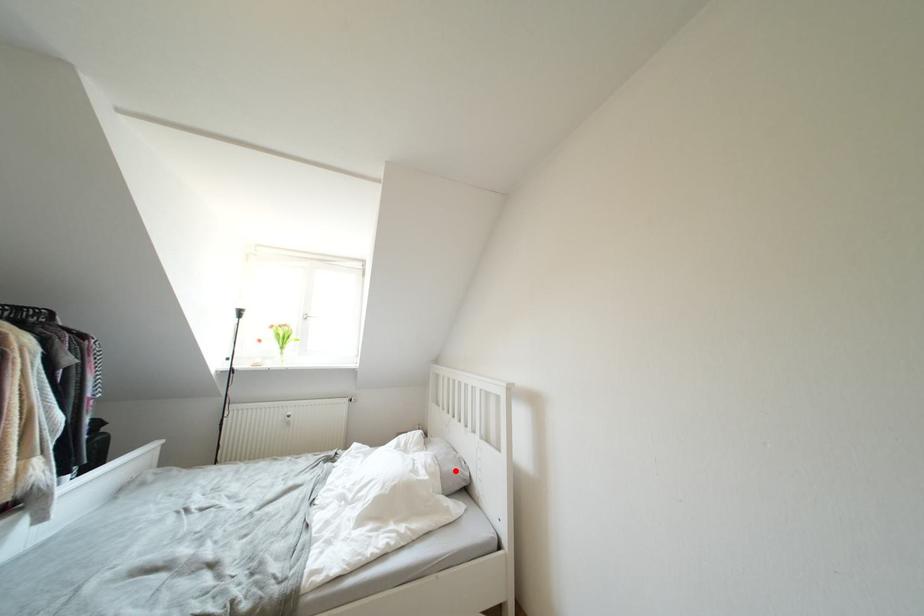
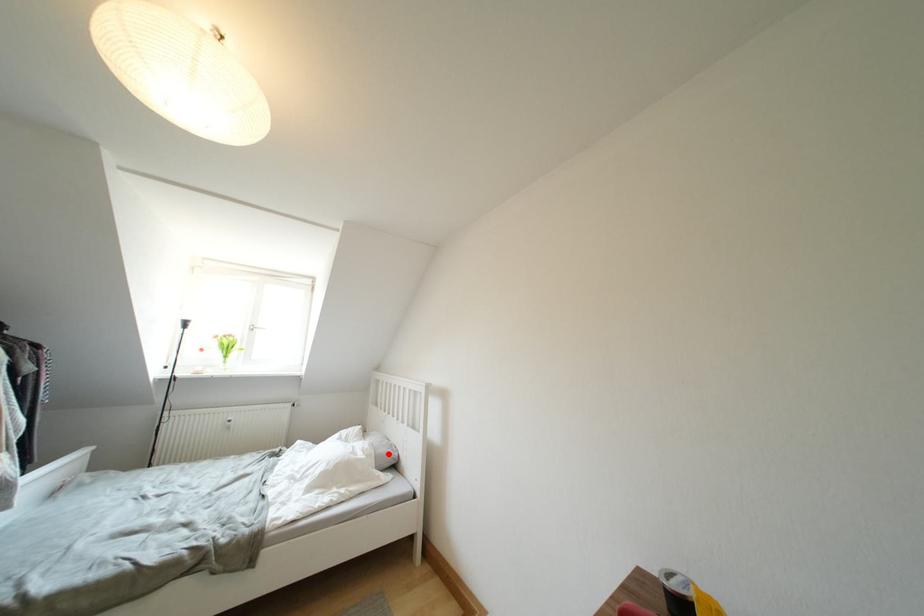
I am providing you with two images of the same scene from different viewpoints. A red point is marked on the first image and another point is marked on the second image. Is the marked point in image1 the same physical position as the marked point in image2?

Yes